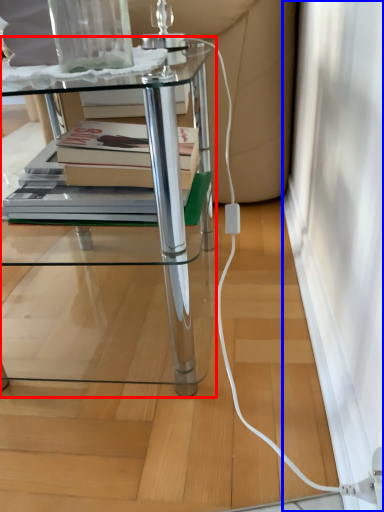
Question: Among these objects, which one is farthest to the camera, table (highlighted by a red box) or screen door (highlighted by a blue box)?

Choices:
 (A) table
 (B) screen door

Answer: (B)